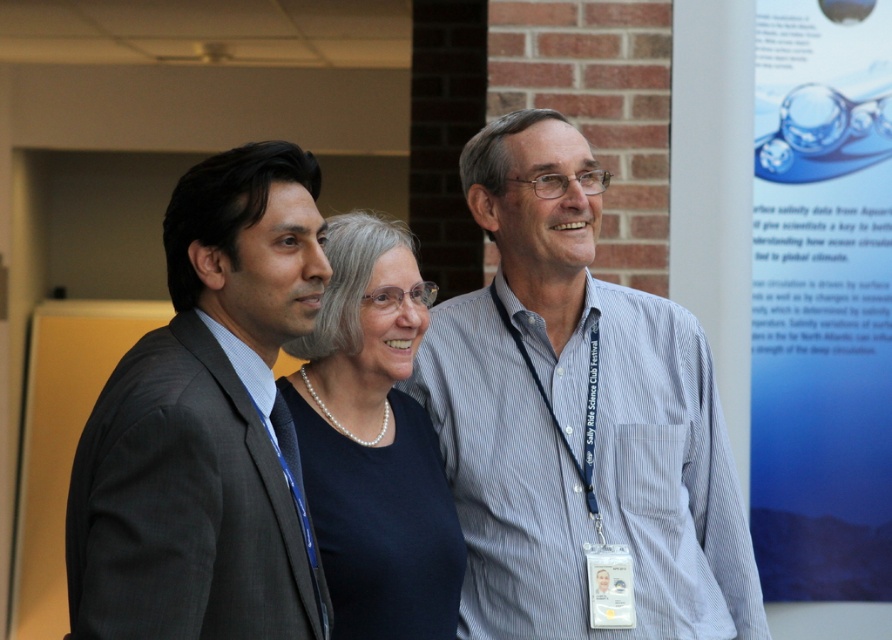
Question: In this image, where is blue paper at upper right located relative to pearl necklace at center?

Choices:
 (A) right
 (B) left

Answer: (A)

Question: Which of these objects is positioned farthest from the blue paper at upper right?

Choices:
 (A) white striped shirt at center
 (B) dark gray suit at left
 (C) pearl necklace at center

Answer: (B)

Question: Which of the following is the farthest from the observer?

Choices:
 (A) pearl necklace at center
 (B) blue paper at upper right
 (C) white striped shirt at center

Answer: (B)

Question: Which of the following is the closest to the observer?

Choices:
 (A) (406, 426)
 (B) (167, 336)
 (C) (840, 12)
 (D) (613, 310)

Answer: (B)

Question: Is white striped shirt at center further to the viewer compared to dark gray suit at left?

Choices:
 (A) no
 (B) yes

Answer: (B)

Question: Does white striped shirt at center lie behind pearl necklace at center?

Choices:
 (A) yes
 (B) no

Answer: (A)